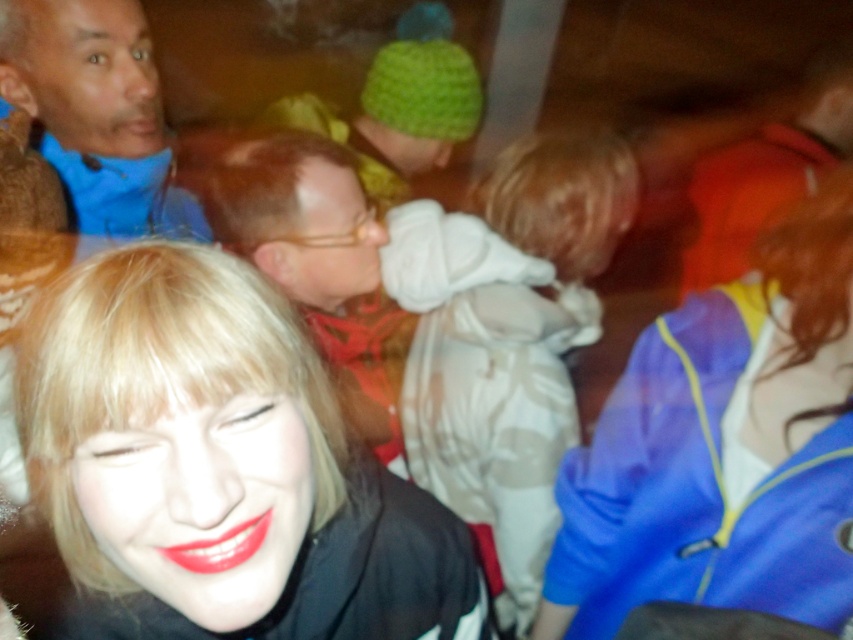
You are standing at the center of the room and want to move towards the shiny black jacket at lower left. Which direction should you move to reach it?

To reach the shiny black jacket at lower left located at point 0.717 on the x axis and 0.252 on the y axis, you should move towards the lower left direction from your current position at the center of the room.

You are organizing a clothing donation drive and need to stack jackets vertically. Given the space constraints, you can only place jackets that are shorter than 20 inches in height. Based on the image, can both the blue fabric jacket at right and the blue fleece jacket at upper left be included in this stack?

The blue fabric jacket at right has a greater height compared to blue fleece jacket at upper left. Since the blue fleece jacket at upper left is shorter than the blue fabric jacket at right, but the exact height of the fleece jacket isn not provided. Therefore, it is uncertain whether either jacket meets the 20 inch height requirement for the stack.

You are organizing a winter clothing drive and need to determine which jacket to recommend for a cold day. Based on the image, which of the two jackets, the blue fabric jacket at right or the blue fleece jacket at upper left, would provide better insulation?

The blue fleece jacket at upper left is thicker than the blue fabric jacket at right, so it would provide better insulation for a cold day.